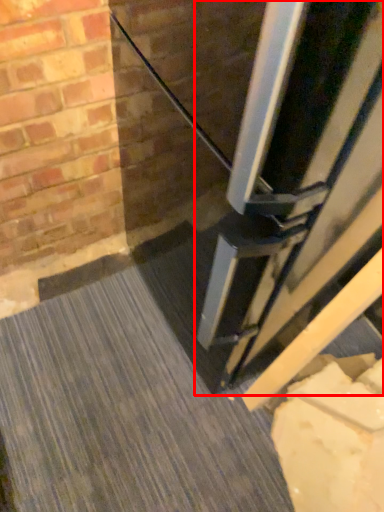
Question: From the image's perspective, what is the correct spatial positioning of door (annotated by the red box) in reference to concrete?

Choices:
 (A) above
 (B) below

Answer: (A)